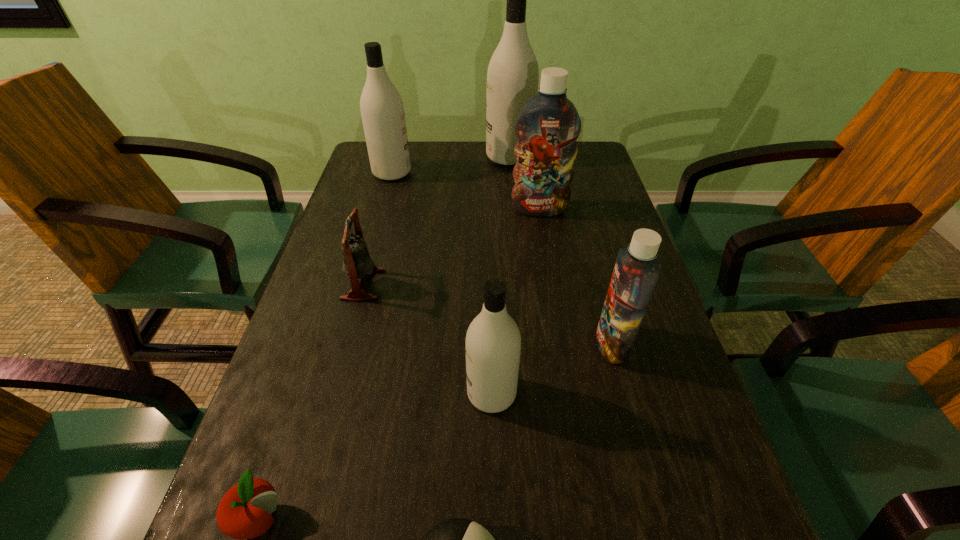
Locate an element on the screen. The image size is (960, 540). vacant region located on the front-facing side of the third nearest object is located at coordinates (417, 393).

Where is `vacant space located on the front-facing side of the third nearest object`? Image resolution: width=960 pixels, height=540 pixels. vacant space located on the front-facing side of the third nearest object is located at coordinates (372, 393).

You are a GUI agent. You are given a task and a screenshot of the screen. Output one action in this format:
    pyautogui.click(x=<x>, y=<y>)
    Task: Click on the vacant area situated on the front-facing side of the third nearest object
    
    Given the screenshot: What is the action you would take?
    pyautogui.click(x=332, y=393)

The image size is (960, 540). What are the coordinates of `vacant space situated 0.170m on the back of the fifth nearest object` in the screenshot? It's located at (380, 222).

This screenshot has width=960, height=540. Identify the location of shampoo that is at the left edge. (382, 110).

What are the coordinates of `bell at the left edge` in the screenshot? It's located at (357, 264).

Identify the location of object that is positioned at the far left corner. (382, 110).

Find the location of a particular element. free space at the far edge of the desktop is located at coordinates (485, 179).

Locate an element on the screen. Image resolution: width=960 pixels, height=540 pixels. free space at the left edge is located at coordinates (376, 236).

The height and width of the screenshot is (540, 960). I want to click on vacant space at the right edge, so click(648, 421).